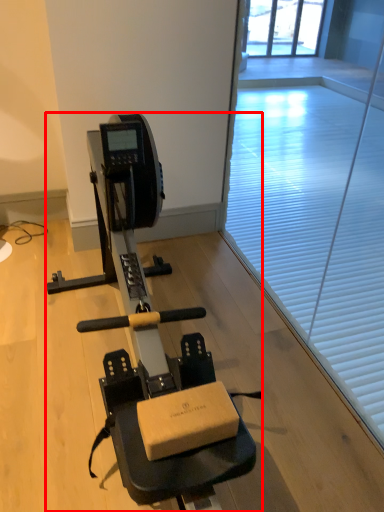
Question: In this image, where is stationary bicycle (annotated by the red box) located relative to window screen?

Choices:
 (A) right
 (B) left

Answer: (B)